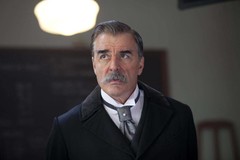
I want to click on ceiling lamp, so click(x=60, y=14).